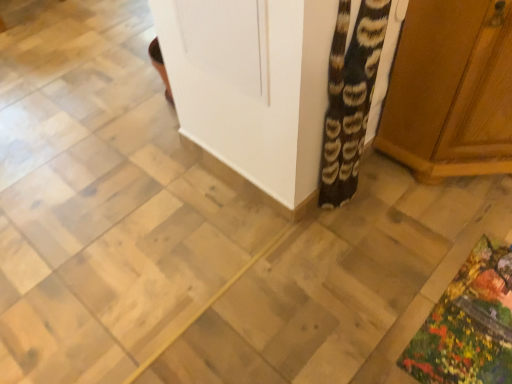
You are a GUI agent. You are given a task and a screenshot of the screen. Output one action in this format:
    pyautogui.click(x=<x>, y=<y>)
    Task: Click on the free space in front of black and white patterned blanket at center
    
    Given the screenshot: What is the action you would take?
    pyautogui.click(x=353, y=245)